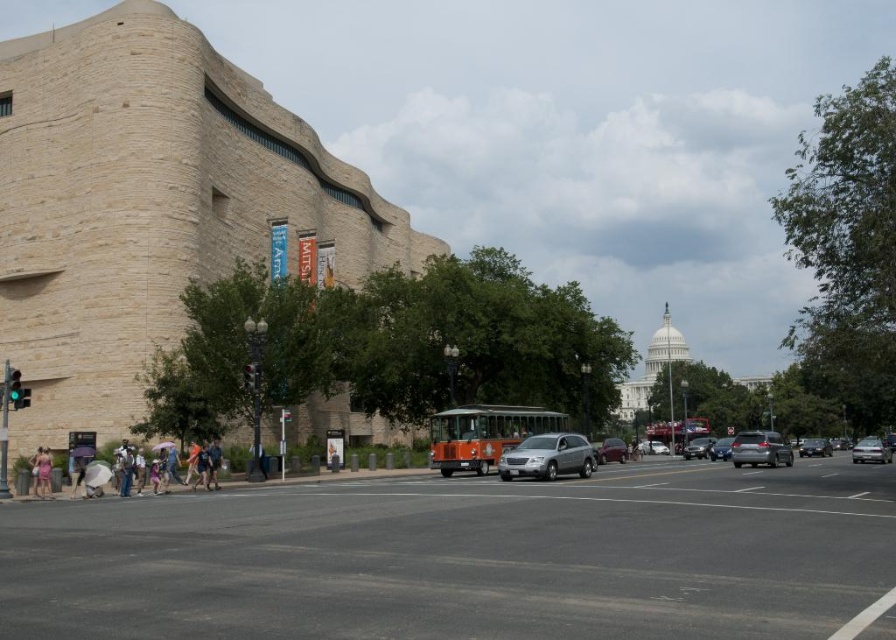
Wait, the objects list has two entries that are almost identical except for the first word. Is this a mistake? Let me check the rules again. The user provided the Objects as silver metallic sedan at center and metallic silver sedan at center. The Objects Description says the first one has lesser height than the second. Hmm, but the labels are almost the same except for the order of

The silver metallic sedan at center is shorter in height than the metallic silver sedan at center. However, this might be an error in labeling since both objects seem to refer to the same type of vehicle. Please verify the object labels for accuracy.

You are standing at point (41, 465) and want to reach the U.S. Capitol Building. The minimum distance you need to walk is 184.51 feet. Is there a shorter path available if you take the trolley bus instead?

The distance between you and the U.S. Capitol Building is 184.51 feet. Taking the trolley bus might provide a faster route, but the question asks about the shortest path. Since the trolley bus follows the road and the straight line distance is 184.51 feet, the shortest path remains walking directly towards the Capitol unless the trolley route is shorter. However, without knowing the trolley path, we can only confirm the straight line distance is 184.51 feet.